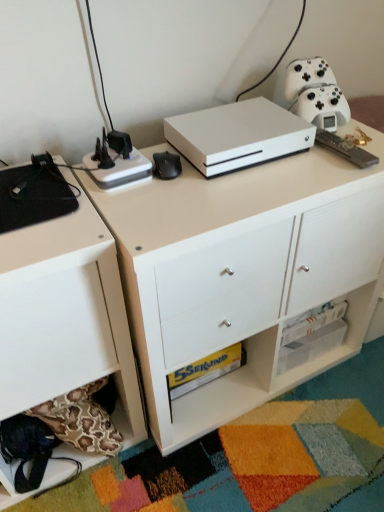
At what (x,y) coordinates should I click in order to perform the action: click on vacant area located to the right-hand side of black plastic power strip at upper left, the second appliance when ordered from left to right. Please return your answer as a coordinate pair (x, y). The width and height of the screenshot is (384, 512). Looking at the image, I should click on (186, 192).